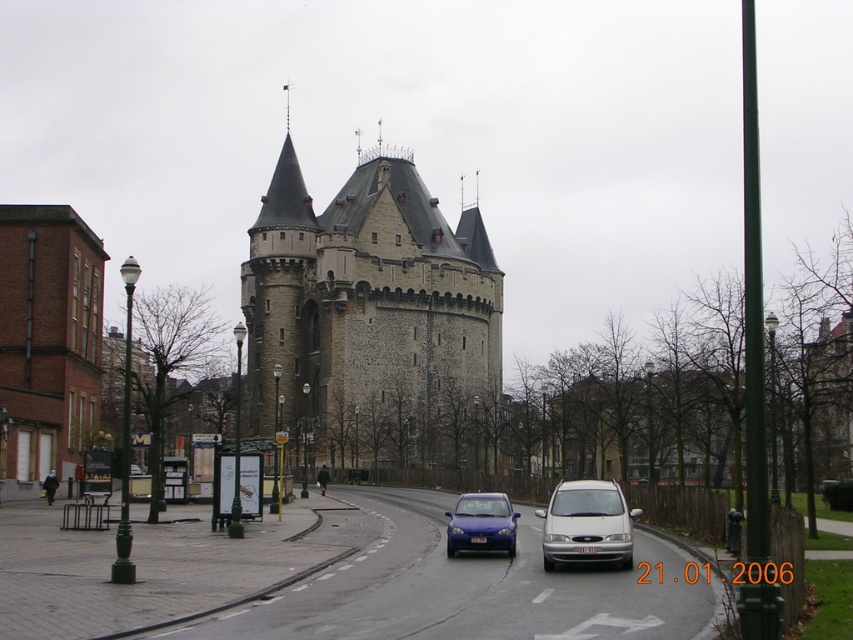
Question: Which point appears farthest from the camera in this image?

Choices:
 (A) (469, 508)
 (B) (399, 314)

Answer: (B)

Question: Can you confirm if silver metallic van at center is positioned to the right of matte blue car at center?

Choices:
 (A) yes
 (B) no

Answer: (A)

Question: Is silver metallic van at center above matte blue car at center?

Choices:
 (A) no
 (B) yes

Answer: (B)

Question: Which point is farther to the camera?

Choices:
 (A) (582, 554)
 (B) (303, 324)
 (C) (479, 550)

Answer: (B)

Question: Is silver metallic van at center below matte blue car at center?

Choices:
 (A) yes
 (B) no

Answer: (B)

Question: Which point is closer to the camera taking this photo?

Choices:
 (A) (555, 490)
 (B) (409, 369)
 (C) (450, 536)

Answer: (C)